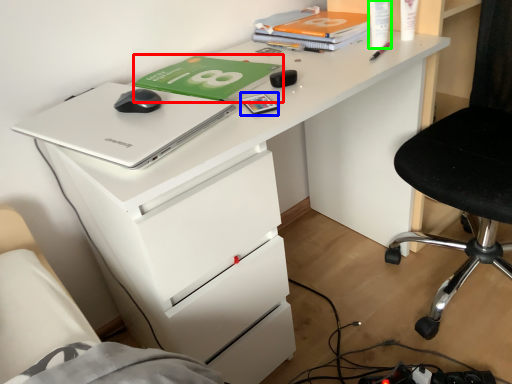
Question: Estimate the real-world distances between objects in this image. Which object is farther from paperback book (highlighted by a red box), stationery (highlighted by a blue box) or stationery (highlighted by a green box)?

Choices:
 (A) stationery
 (B) stationery

Answer: (B)